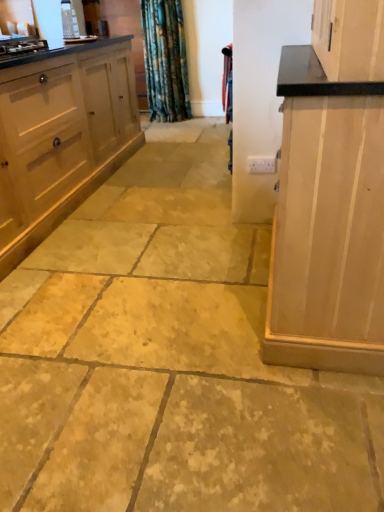
Question: From the image's perspective, would you say light wood cabinet at right, which ranks as the 1th cabinetry in right-to-left order, is shown under white wood cabinet at left, marked as the second cabinetry in a right-to-left arrangement?

Choices:
 (A) yes
 (B) no

Answer: (A)

Question: Considering the relative sizes of light wood cabinet at right, arranged as the 2th cabinetry when viewed from the left, and white wood cabinet at left, marked as the second cabinetry in a right-to-left arrangement, in the image provided, is light wood cabinet at right, arranged as the 2th cabinetry when viewed from the left, thinner than white wood cabinet at left, marked as the second cabinetry in a right-to-left arrangement,?

Choices:
 (A) no
 (B) yes

Answer: (B)

Question: From a real-world perspective, is light wood cabinet at right, which ranks as the 1th cabinetry in right-to-left order, on top of white wood cabinet at left, positioned as the 1th cabinetry in left-to-right order?

Choices:
 (A) yes
 (B) no

Answer: (A)

Question: Is light wood cabinet at right, which ranks as the 1th cabinetry in right-to-left order, bigger than white wood cabinet at left, positioned as the 1th cabinetry in left-to-right order?

Choices:
 (A) yes
 (B) no

Answer: (B)

Question: Is light wood cabinet at right, arranged as the 2th cabinetry when viewed from the left, facing towards white wood cabinet at left, positioned as the 1th cabinetry in left-to-right order?

Choices:
 (A) no
 (B) yes

Answer: (B)

Question: Is light wood cabinet at right, arranged as the 2th cabinetry when viewed from the left, taller or shorter than velvet-like red curtain at center?

Choices:
 (A) tall
 (B) short

Answer: (A)

Question: Is light wood cabinet at right, which ranks as the 1th cabinetry in right-to-left order, to the left or to the right of velvet-like red curtain at center in the image?

Choices:
 (A) left
 (B) right

Answer: (B)

Question: Is light wood cabinet at right, arranged as the 2th cabinetry when viewed from the left, in front of or behind velvet-like red curtain at center in the image?

Choices:
 (A) front
 (B) behind

Answer: (A)

Question: From the image's perspective, is light wood cabinet at right, which ranks as the 1th cabinetry in right-to-left order, above or below velvet-like red curtain at center?

Choices:
 (A) above
 (B) below

Answer: (B)

Question: Considering the positions of white wood cabinet at left, marked as the second cabinetry in a right-to-left arrangement, and velvet-like red curtain at center in the image, is white wood cabinet at left, marked as the second cabinetry in a right-to-left arrangement, wider or thinner than velvet-like red curtain at center?

Choices:
 (A) thin
 (B) wide

Answer: (B)

Question: Considering the positions of white wood cabinet at left, marked as the second cabinetry in a right-to-left arrangement, and velvet-like red curtain at center in the image, is white wood cabinet at left, marked as the second cabinetry in a right-to-left arrangement, bigger or smaller than velvet-like red curtain at center?

Choices:
 (A) small
 (B) big

Answer: (B)

Question: Is white wood cabinet at left, marked as the second cabinetry in a right-to-left arrangement, in front of or behind velvet-like red curtain at center in the image?

Choices:
 (A) front
 (B) behind

Answer: (A)

Question: From their relative heights in the image, would you say white wood cabinet at left, marked as the second cabinetry in a right-to-left arrangement, is taller or shorter than velvet-like red curtain at center?

Choices:
 (A) short
 (B) tall

Answer: (B)

Question: From the image's perspective, is velvet-like red curtain at center positioned above or below light wood cabinet at right, arranged as the 2th cabinetry when viewed from the left?

Choices:
 (A) below
 (B) above

Answer: (B)

Question: Considering the positions of velvet-like red curtain at center and light wood cabinet at right, which ranks as the 1th cabinetry in right-to-left order, in the image, is velvet-like red curtain at center wider or thinner than light wood cabinet at right, which ranks as the 1th cabinetry in right-to-left order,?

Choices:
 (A) thin
 (B) wide

Answer: (A)